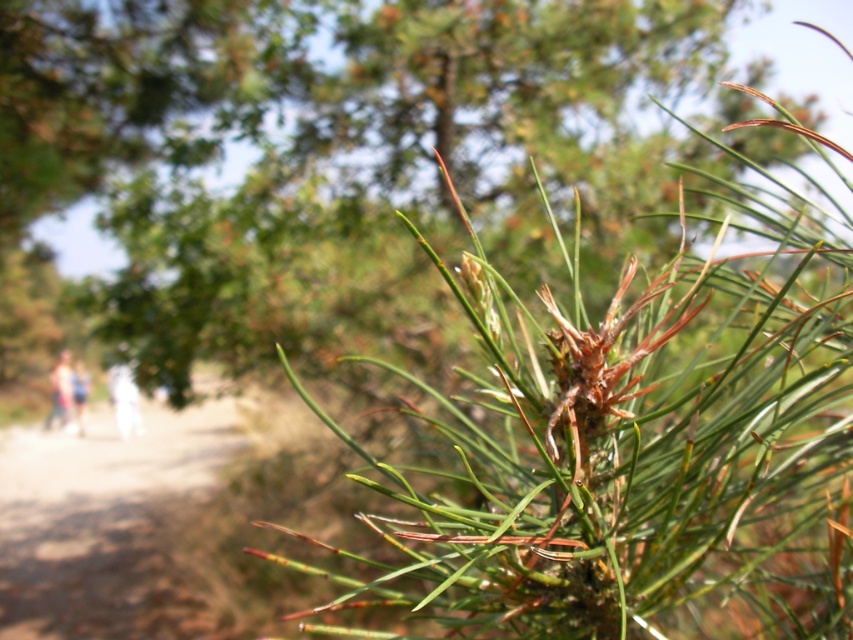
Between green needle-like pine at upper right and white cotton pants at lower left, which one is positioned higher?

green needle-like pine at upper right is above.

Who is shorter, green needle-like pine at upper right or white cotton pants at lower left?

Standing shorter between the two is white cotton pants at lower left.

Where is `green needle-like pine at upper right`? green needle-like pine at upper right is located at coordinates (633, 438).

Is brown dirt trail at lower left taller than white cotton pants at lower left?

Correct, brown dirt trail at lower left is much taller as white cotton pants at lower left.

Can you confirm if brown dirt trail at lower left is wider than white cotton pants at lower left?

Correct, the width of brown dirt trail at lower left exceeds that of white cotton pants at lower left.

This screenshot has width=853, height=640. I want to click on brown dirt trail at lower left, so click(x=103, y=522).

I want to click on brown dirt trail at lower left, so click(x=103, y=522).

Can you confirm if brown dirt trail at lower left is positioned to the right of light blue jeans at left?

Correct, you'll find brown dirt trail at lower left to the right of light blue jeans at left.

Can you confirm if brown dirt trail at lower left is positioned below light blue jeans at left?

Yes, brown dirt trail at lower left is below light blue jeans at left.

Consider the image. Who is more distant from viewer, [119,445] or [51,396]?

The point [119,445] is behind.

In order to click on brown dirt trail at lower left in this screenshot , I will do `click(103, 522)`.